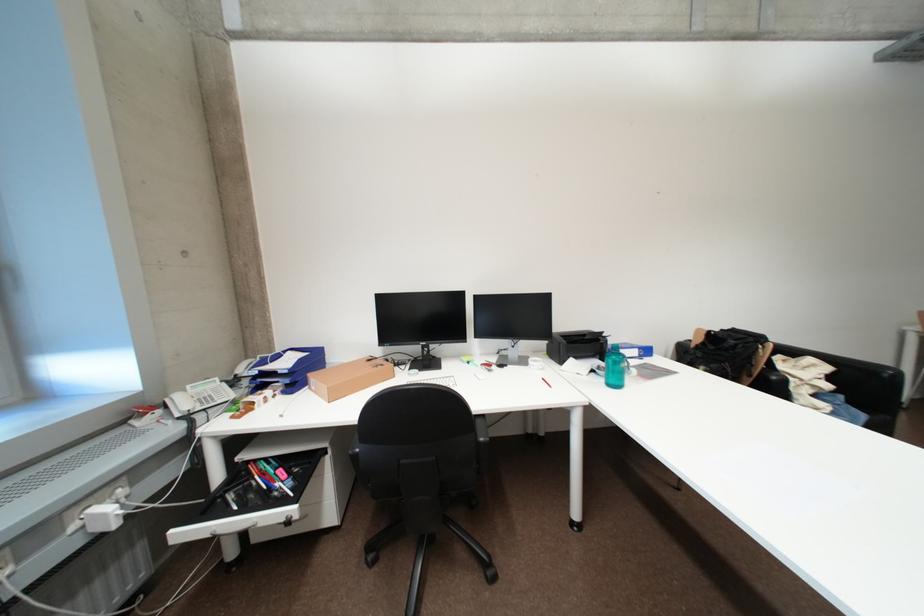
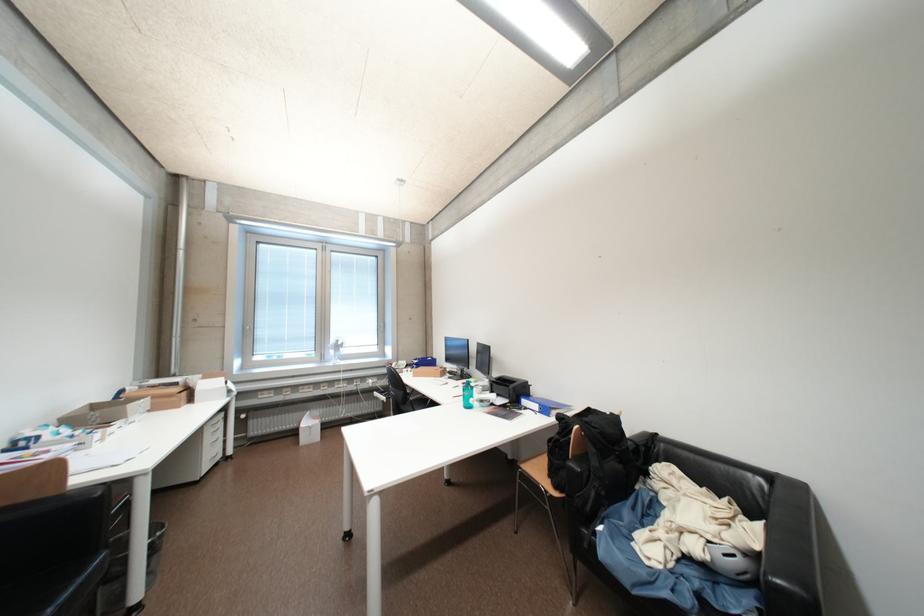
In the second image, find the point that corresponds to (x=835, y=387) in the first image.

(704, 551)